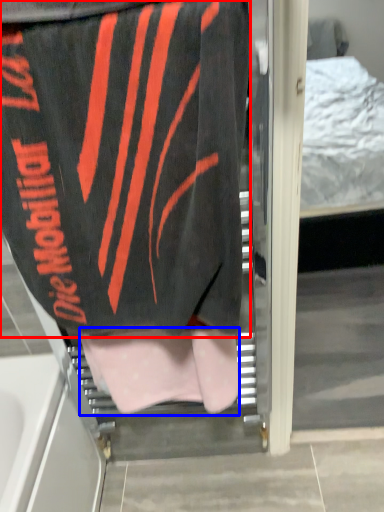
Question: Which object appears farthest to the camera in this image, towel (highlighted by a red box) or underclothes (highlighted by a blue box)?

Choices:
 (A) towel
 (B) underclothes

Answer: (B)